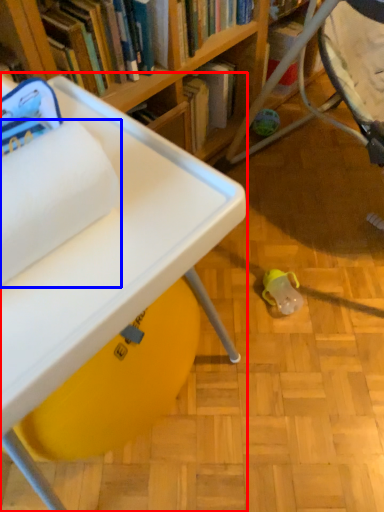
Question: Which of the following is the closest to the observer, table (highlighted by a red box) or toilet paper (highlighted by a blue box)?

Choices:
 (A) table
 (B) toilet paper

Answer: (B)